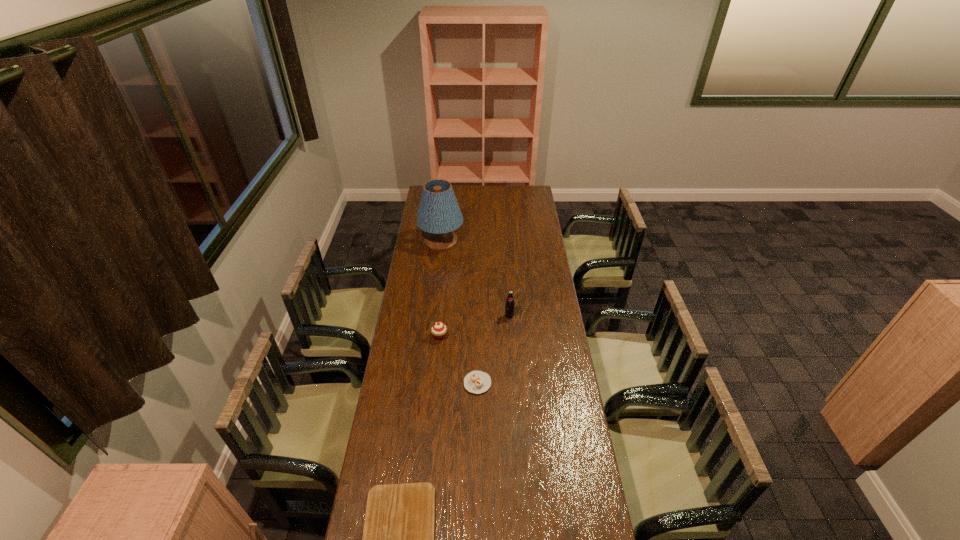
Where is `vacant space located 0.340m on the back of the left cupcake`? The height and width of the screenshot is (540, 960). vacant space located 0.340m on the back of the left cupcake is located at coordinates (444, 280).

Identify the location of vacant space located on the back of the nearer cupcake. (478, 305).

I want to click on lampshade present at the left edge, so click(x=439, y=214).

Locate an element on the screen. The width and height of the screenshot is (960, 540). cupcake situated at the left edge is located at coordinates (438, 329).

Locate an element on the screen. The height and width of the screenshot is (540, 960). vacant space at the left edge is located at coordinates (397, 360).

Locate an element on the screen. vacant area at the right edge is located at coordinates pyautogui.click(x=529, y=311).

You are a GUI agent. You are given a task and a screenshot of the screen. Output one action in this format:
    pyautogui.click(x=<x>, y=<y>)
    Task: Click on the vacant space that is in between the lampshade and the taller cupcake
    This screenshot has height=540, width=960.
    Given the screenshot: What is the action you would take?
    pyautogui.click(x=441, y=289)

Where is `unoccupied area between the right cupcake and the second tallest object`? Image resolution: width=960 pixels, height=540 pixels. unoccupied area between the right cupcake and the second tallest object is located at coordinates coord(493,349).

Locate an element on the screen. empty location between the second farthest object and the fourth farthest object is located at coordinates (493, 349).

At what (x,y) coordinates should I click in order to perform the action: click on vacant space that's between the second tallest object and the shorter cupcake. Please return your answer as a coordinate pair (x, y). Image resolution: width=960 pixels, height=540 pixels. Looking at the image, I should click on (493, 349).